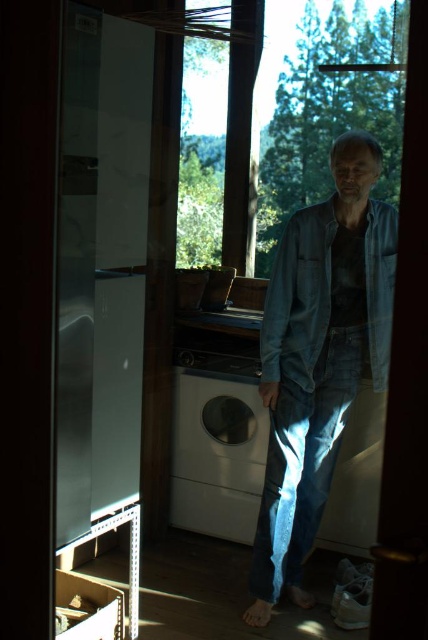
You are standing at the point marked as point (297,506). You need to move to the washing machine near the window. Is there enough space to walk directly to it without moving any objects?

The distance between the point (297,506) and the washing machine near the window is 1.55 meters. Since the path is clear and the distance is sufficient, you can walk directly to the washing machine without needing to move any objects.

You are organizing a laundry day and need to place the denim shirt at center and faded denim jacket at lower right into the washing machine. Which item should you put into the washer first to ensure proper washing?

The denim shirt at center should be placed into the washer first since it is positioned under the faded denim jacket at lower right, meaning it is closer to the washing machine.

You are a delivery person who just arrived at the cabin with a package. You need to place the package on the floor near the white matte washing machine at center without getting too close to it. The delivery robot you are using has a 1.2 meter reach. Can the robot place the package from your current position?

The white matte washing machine at center is 1.56 meters away from the viewer. Since the delivery robot has a 1.2 meter reach, it cannot reach the washing machine from the current position. You need to move closer.